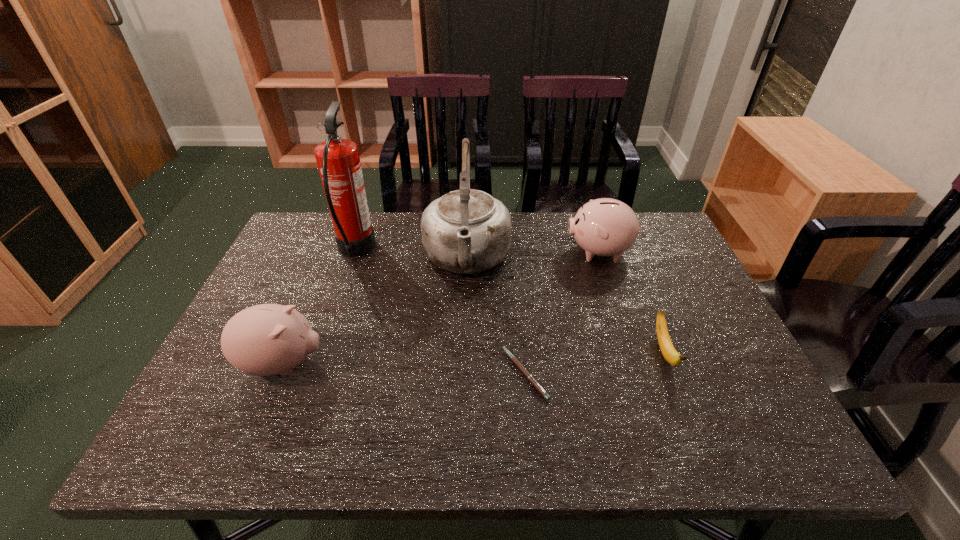
Image resolution: width=960 pixels, height=540 pixels. Identify the location of object located in the far right corner section of the desktop. (604, 227).

In the image, there is a desktop. Identify the location of free space at the far edge. This screenshot has width=960, height=540. (540, 215).

I want to click on vacant space at the near edge of the desktop, so click(600, 416).

Locate an element on the screen. This screenshot has height=540, width=960. blank space at the right edge of the desktop is located at coordinates (729, 357).

The width and height of the screenshot is (960, 540). What are the coordinates of `vacant space at the near left corner of the desktop` in the screenshot? It's located at click(184, 434).

Find the location of a particular element. This screenshot has width=960, height=540. vacant space at the near right corner is located at coordinates (752, 430).

The width and height of the screenshot is (960, 540). I want to click on vacant area between the nearer piggy bank and the second shortest object, so click(x=473, y=358).

Locate an element on the screen. This screenshot has height=540, width=960. free space between the farther piggy bank and the fifth shortest object is located at coordinates (535, 255).

Where is `unoccupied position between the fifth tallest object and the shortest object`? unoccupied position between the fifth tallest object and the shortest object is located at coordinates (594, 363).

Locate an element on the screen. vacant area that lies between the banana and the tallest object is located at coordinates (510, 301).